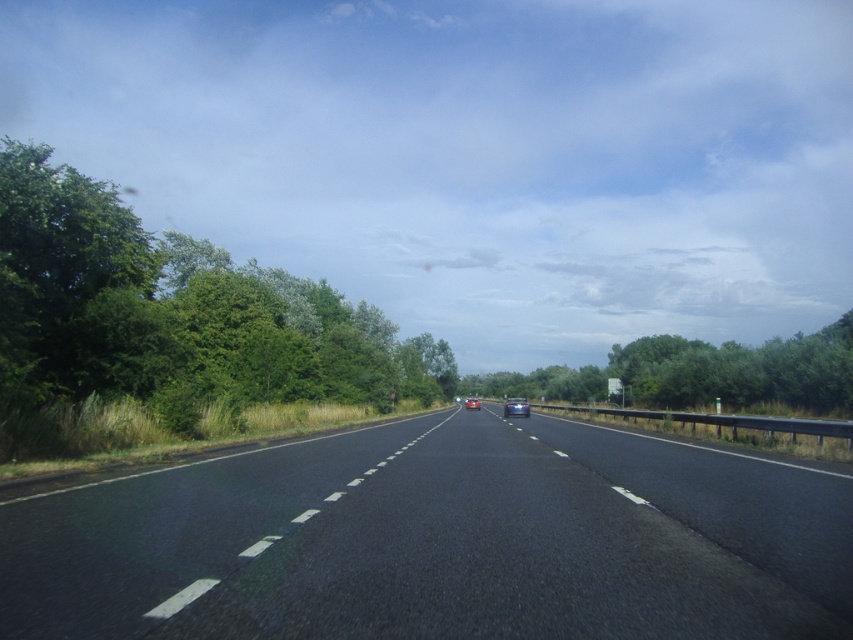
You are standing on the side of the road and want to reach the green leafy trees at left. If your walking speed is 1.5 meters per second, how many seconds will it take you to reach them?

The green leafy trees at left are 15.18 meters away from the viewer. At a walking speed of 1.5 meters per second, it will take 15.18 divided by 1.5, which equals approximately 10.12 seconds to reach them.

You are a driver approaching the point marked as point (166, 326) on the road. What will you see to your left?

You will see green leafy trees at left to your left side as you approach point (166, 326) on the road.

You are driving a car and see the green leafy trees at left and the green leafy tree at center from your current position. Which one appears bigger to you?

The green leafy trees at left appears bigger than the green leafy tree at center because it is larger in size.